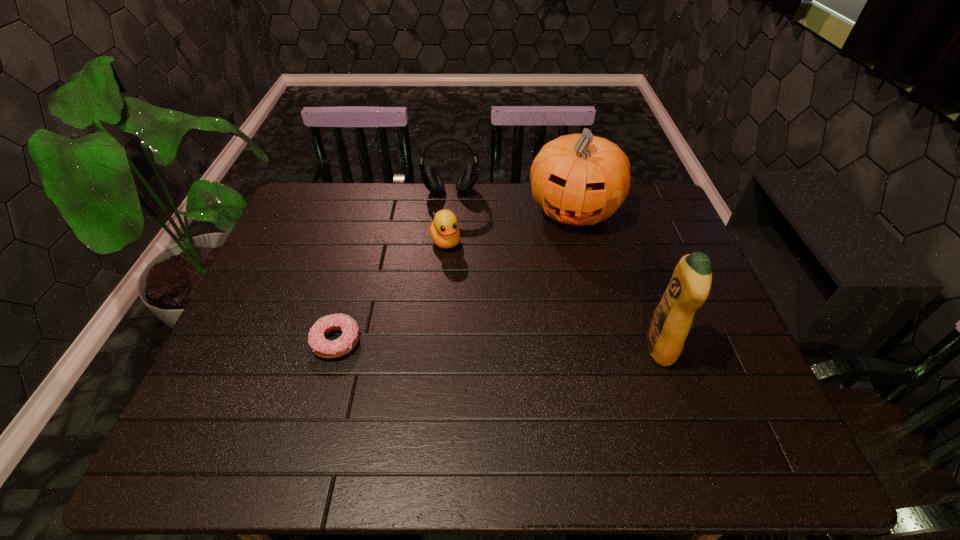
This screenshot has width=960, height=540. I want to click on blank space located 0.240m on the face of the duckling, so click(x=479, y=313).

The image size is (960, 540). Find the location of `free space located on the face of the duckling`. free space located on the face of the duckling is located at coordinates (473, 302).

Find the location of a particular element. vacant region located on the face of the duckling is located at coordinates (462, 279).

Find the location of a particular element. free spot located on the ear cups of the headset is located at coordinates (452, 242).

Locate an element on the screen. This screenshot has height=540, width=960. vacant space situated 0.210m on the ear cups of the headset is located at coordinates (452, 242).

Locate an element on the screen. This screenshot has height=540, width=960. vacant region located on the ear cups of the headset is located at coordinates (452, 240).

You are a GUI agent. You are given a task and a screenshot of the screen. Output one action in this format:
    pyautogui.click(x=<x>, y=<y>)
    Task: Click on the vacant space located 0.080m on the front-facing side of the pumpkin
    
    Given the screenshot: What is the action you would take?
    pyautogui.click(x=564, y=256)

This screenshot has height=540, width=960. I want to click on free space located 0.320m on the front-facing side of the pumpkin, so click(x=549, y=319).

I want to click on free spot located 0.210m on the front-facing side of the pumpkin, so click(x=556, y=288).

You are a GUI agent. You are given a task and a screenshot of the screen. Output one action in this format:
    pyautogui.click(x=<x>, y=<y>)
    Task: Click on the headset positioned at the far edge
    Image resolution: width=960 pixels, height=540 pixels.
    Given the screenshot: What is the action you would take?
    pyautogui.click(x=431, y=178)